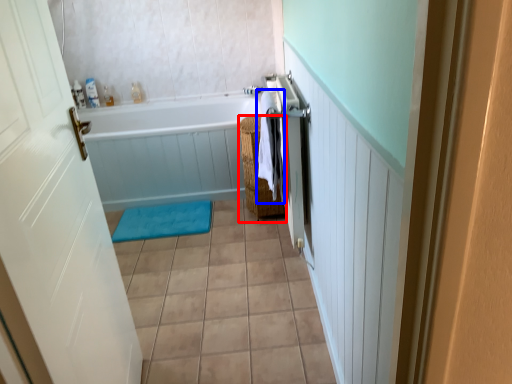
Question: Which object appears farthest to the camera in this image, basket (highlighted by a red box) or beach towel (highlighted by a blue box)?

Choices:
 (A) basket
 (B) beach towel

Answer: (A)